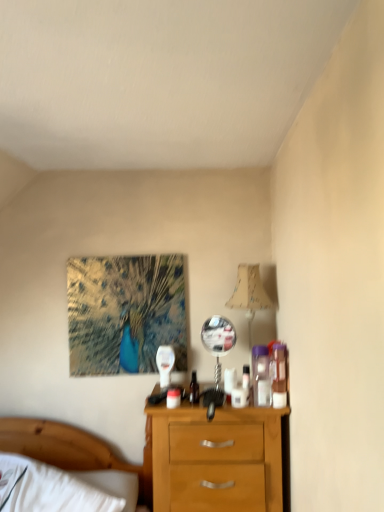
Question: Is translucent plastic container at right, arranged as the second toiletry when viewed from the right, outside of matte plastic bottle at center?

Choices:
 (A) yes
 (B) no

Answer: (A)

Question: Is translucent plastic container at right, the 1th toiletry when ordered from left to right, beside matte plastic bottle at center?

Choices:
 (A) yes
 (B) no

Answer: (B)

Question: Can you confirm if translucent plastic container at right, arranged as the second toiletry when viewed from the right, is bigger than matte plastic bottle at center?

Choices:
 (A) yes
 (B) no

Answer: (A)

Question: Is translucent plastic container at right, the 1th toiletry when ordered from left to right, smaller than matte plastic bottle at center?

Choices:
 (A) yes
 (B) no

Answer: (B)

Question: Is matte plastic bottle at center at the back of translucent plastic container at right, arranged as the second toiletry when viewed from the right?

Choices:
 (A) no
 (B) yes

Answer: (A)

Question: Is translucent plastic container at right, the 1th toiletry when ordered from left to right, thinner than matte plastic bottle at center?

Choices:
 (A) yes
 (B) no

Answer: (B)

Question: Does translucent plastic container at right, the 1th toiletry when ordered from left to right, appear on the left side of white wood bed at lower left?

Choices:
 (A) no
 (B) yes

Answer: (A)

Question: Is translucent plastic container at right, the 1th toiletry when ordered from left to right, next to white wood bed at lower left?

Choices:
 (A) yes
 (B) no

Answer: (B)

Question: Is translucent plastic container at right, arranged as the second toiletry when viewed from the right, bigger than white wood bed at lower left?

Choices:
 (A) no
 (B) yes

Answer: (A)

Question: From a real-world perspective, is translucent plastic container at right, arranged as the second toiletry when viewed from the right, positioned over white wood bed at lower left based on gravity?

Choices:
 (A) no
 (B) yes

Answer: (B)

Question: Considering the relative sizes of translucent plastic container at right, the 1th toiletry when ordered from left to right, and white wood bed at lower left in the image provided, is translucent plastic container at right, the 1th toiletry when ordered from left to right, shorter than white wood bed at lower left?

Choices:
 (A) yes
 (B) no

Answer: (A)

Question: Considering the relative positions of translucent plastic container at right, the 1th toiletry when ordered from left to right, and white wood bed at lower left in the image provided, is translucent plastic container at right, the 1th toiletry when ordered from left to right, in front of white wood bed at lower left?

Choices:
 (A) no
 (B) yes

Answer: (A)

Question: Is translucent plastic container at right, the second toiletry positioned from the left, oriented towards translucent plastic container at right, the 1th toiletry when ordered from left to right?

Choices:
 (A) no
 (B) yes

Answer: (A)